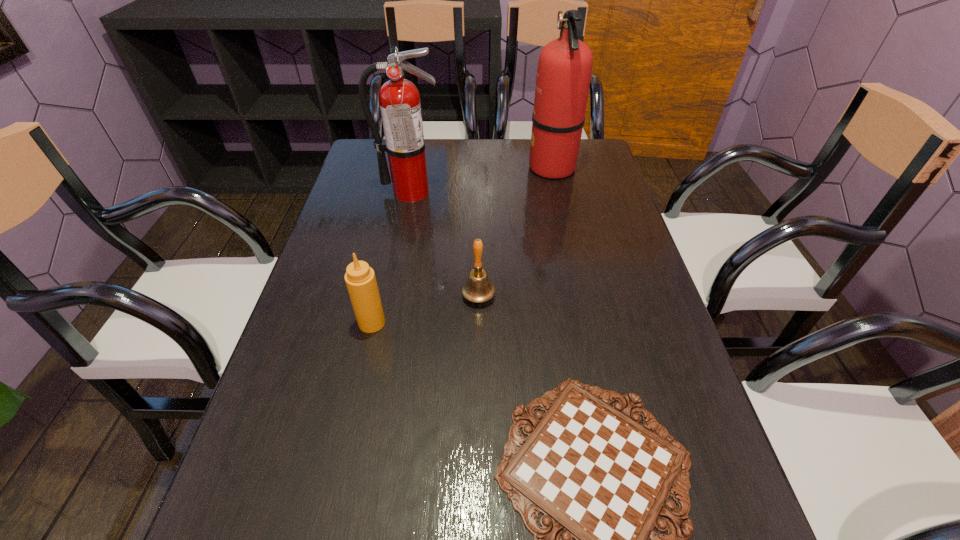
The width and height of the screenshot is (960, 540). Identify the location of free space at the far right corner. (605, 161).

Identify the location of free space between the left fire extinguisher and the right fire extinguisher. (481, 179).

Find the location of a particular element. vacant area that lies between the right fire extinguisher and the bell is located at coordinates (516, 232).

This screenshot has height=540, width=960. What are the coordinates of `vacant area between the left fire extinguisher and the fourth farthest object` in the screenshot? It's located at (391, 257).

You are a GUI agent. You are given a task and a screenshot of the screen. Output one action in this format:
    pyautogui.click(x=<x>, y=<y>)
    Task: Click on the vacant area that lies between the left fire extinguisher and the bell
    The height and width of the screenshot is (540, 960).
    Given the screenshot: What is the action you would take?
    pyautogui.click(x=444, y=244)

I want to click on free space between the condiment and the left fire extinguisher, so click(x=391, y=257).

Identify the location of vacant space that is in between the right fire extinguisher and the left fire extinguisher. (481, 179).

The image size is (960, 540). What are the coordinates of `free spot between the right fire extinguisher and the third nearest object` in the screenshot? It's located at (516, 232).

You are a GUI agent. You are given a task and a screenshot of the screen. Output one action in this format:
    pyautogui.click(x=<x>, y=<y>)
    Task: Click on the free point between the bell and the condiment
    The width and height of the screenshot is (960, 540).
    Given the screenshot: What is the action you would take?
    pyautogui.click(x=425, y=309)

Find the location of a particular element. vacant area that lies between the left fire extinguisher and the second nearest object is located at coordinates (391, 257).